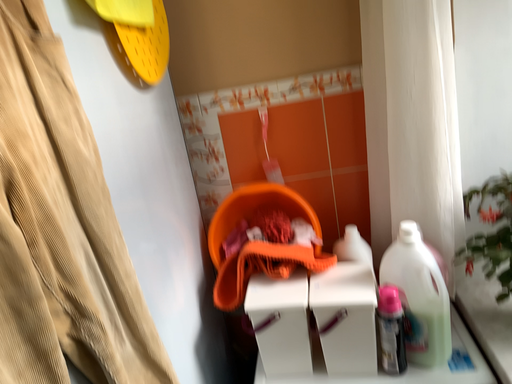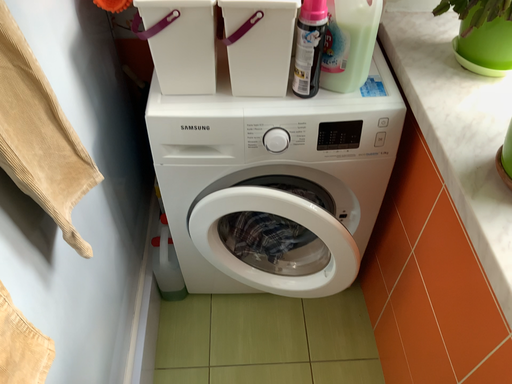
Question: How did the camera likely rotate when shooting the video?

Choices:
 (A) rotated right
 (B) rotated left

Answer: (A)